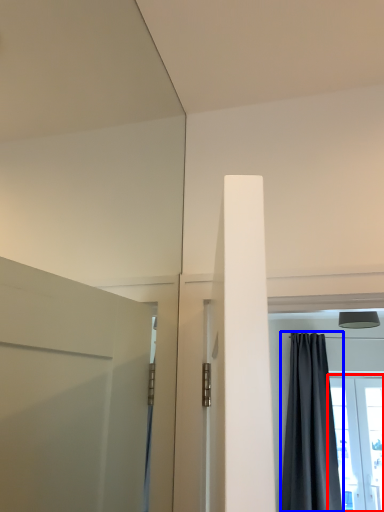
Question: Which object is further to the camera taking this photo, window (highlighted by a red box) or curtain (highlighted by a blue box)?

Choices:
 (A) window
 (B) curtain

Answer: (A)